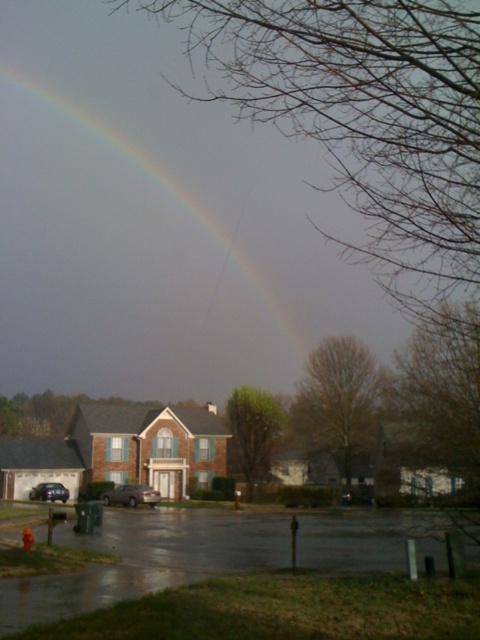
You are standing on the sidewalk and see the wet asphalt at lower center and the shiny black sedan at lower left. Which object is nearer to you?

The wet asphalt at lower center is closer to the viewer than the shiny black sedan at lower left.

You are a delivery driver who needs to park your vehicle, a sedan, in an area that can accommodate its size. The scene shows a wet asphalt at lower center and a satin gold sedan at center. Which location would be more suitable for parking your sedan?

The wet asphalt at lower center is larger in size than the satin gold sedan at center, so it would be more suitable for parking the sedan there as it has enough space.